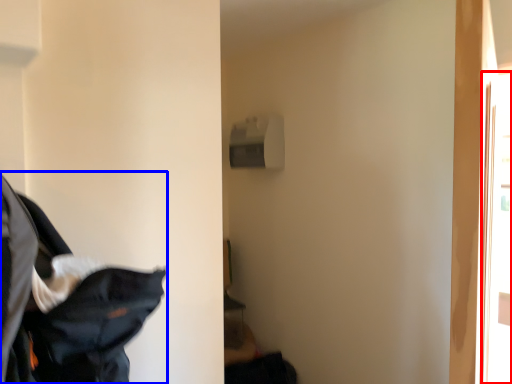
Question: Which point is closer to the camera, screen door (highlighted by a red box) or laundry (highlighted by a blue box)?

Choices:
 (A) screen door
 (B) laundry

Answer: (B)